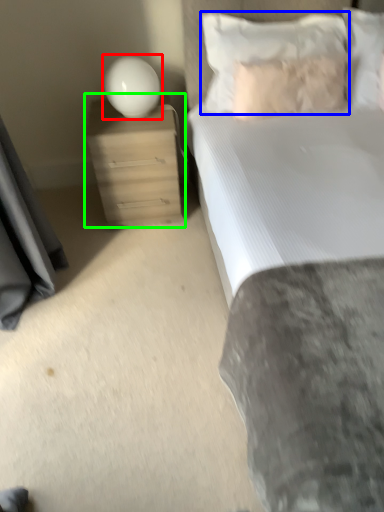
Question: Considering the real-world distances, which object is farthest from lamp (highlighted by a red box)? pillow (highlighted by a blue box) or nightstand (highlighted by a green box)?

Choices:
 (A) pillow
 (B) nightstand

Answer: (A)